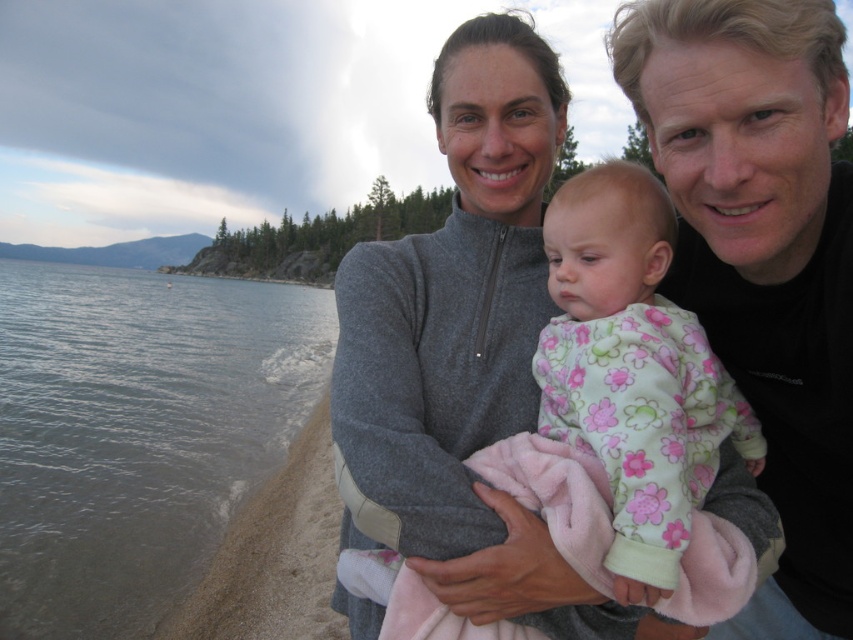
Who is higher up, gray water at lower left or fluffy pink pajamas at center?

gray water at lower left

Who is taller, gray water at lower left or fluffy pink pajamas at center?

With more height is gray water at lower left.

Locate an element on the screen. The width and height of the screenshot is (853, 640). gray water at lower left is located at coordinates (137, 433).

You are a GUI agent. You are given a task and a screenshot of the screen. Output one action in this format:
    pyautogui.click(x=<x>, y=<y>)
    Task: Click on the gray water at lower left
    This screenshot has width=853, height=640.
    Given the screenshot: What is the action you would take?
    pyautogui.click(x=137, y=433)

Who is positioned more to the right, black matte shirt at upper right or fluffy pink pajamas at center?

Positioned to the right is black matte shirt at upper right.

Does black matte shirt at upper right appear on the left side of fluffy pink pajamas at center?

No, black matte shirt at upper right is not to the left of fluffy pink pajamas at center.

Does point (755, 252) lie in front of point (637, 400)?

No, it is not.

Identify the location of black matte shirt at upper right. (763, 257).

Can you confirm if gray water at lower left is taller than black matte shirt at upper right?

Indeed, gray water at lower left has a greater height compared to black matte shirt at upper right.

Identify the location of gray water at lower left. The image size is (853, 640). (137, 433).